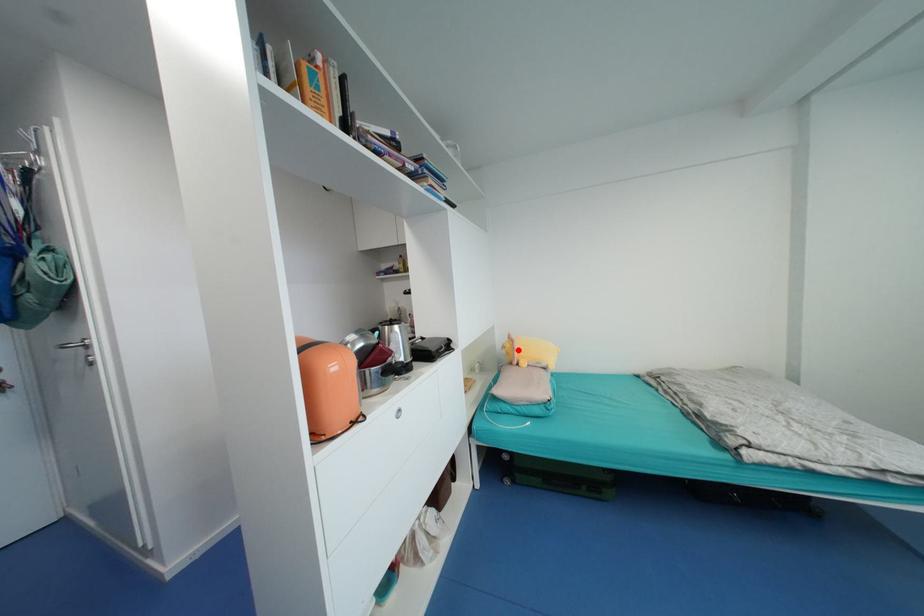
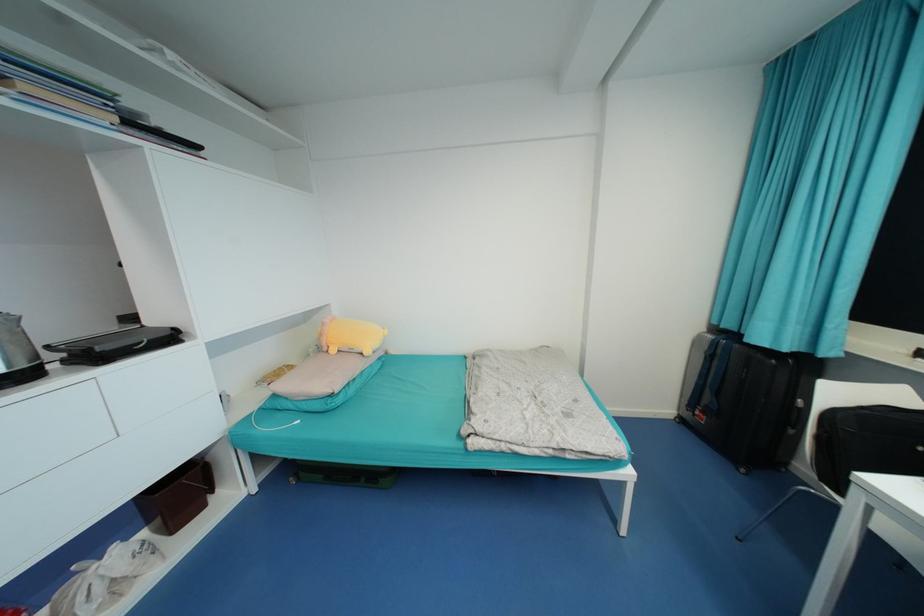
Find the pixel in the second image that matches the highlighted location in the first image.

(325, 334)